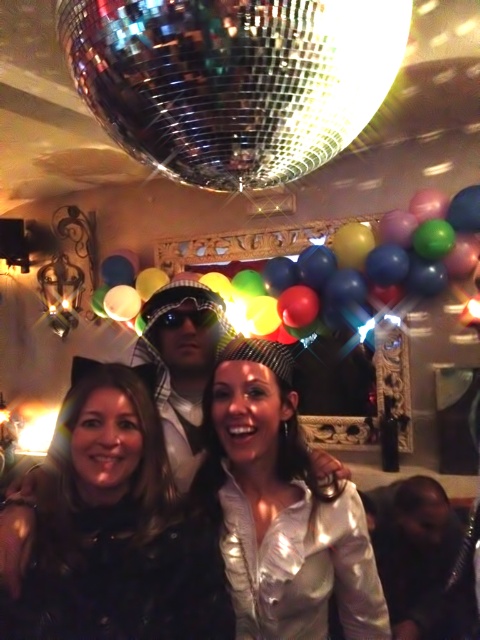
You are at a party and want to hang a new metallic balloon near the shiny metallic balloons at upper center and the shiny metallic balloon at upper center. Which one has a larger size?

The shiny metallic balloons at upper center has a larger size than the shiny metallic balloon at upper center because the former is plural and the latter is singular.